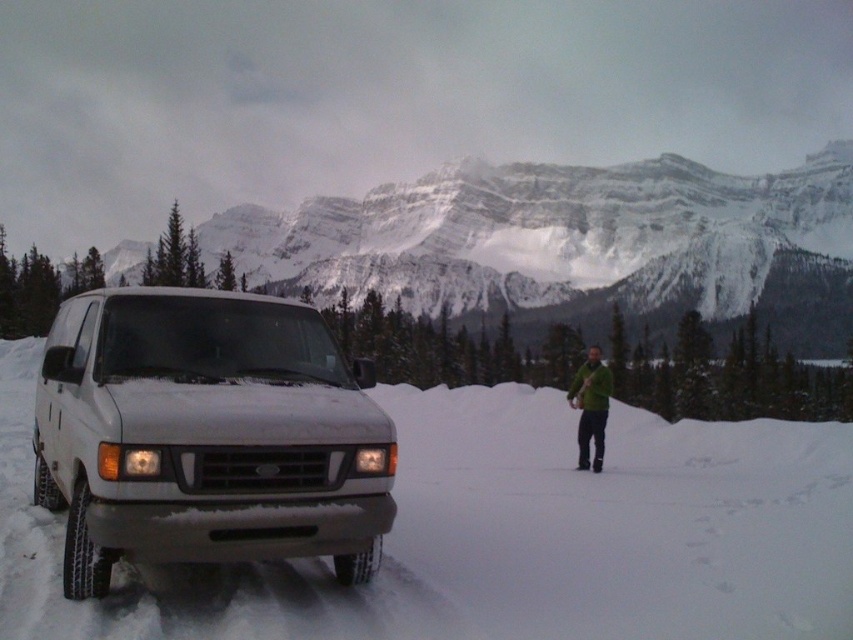
Question: Does white powdery snow at center have a larger size compared to snowy granite mountain at upper center?

Choices:
 (A) yes
 (B) no

Answer: (B)

Question: Estimate the real-world distances between objects in this image. Which object is closer to the white matte suv at left?

Choices:
 (A) snowy granite mountain at upper center
 (B) white powdery snow at center

Answer: (B)

Question: Can you confirm if snowy granite mountain at upper center is positioned to the right of white matte suv at left?

Choices:
 (A) yes
 (B) no

Answer: (A)

Question: Which object is the closest to the white matte suv at left?

Choices:
 (A) snowy granite mountain at upper center
 (B) white powdery snow at center

Answer: (B)

Question: Can you confirm if white powdery snow at center is smaller than snowy granite mountain at upper center?

Choices:
 (A) no
 (B) yes

Answer: (B)

Question: Which of the following is the farthest from the observer?

Choices:
 (A) snowy granite mountain at upper center
 (B) white matte suv at left
 (C) white powdery snow at center

Answer: (A)